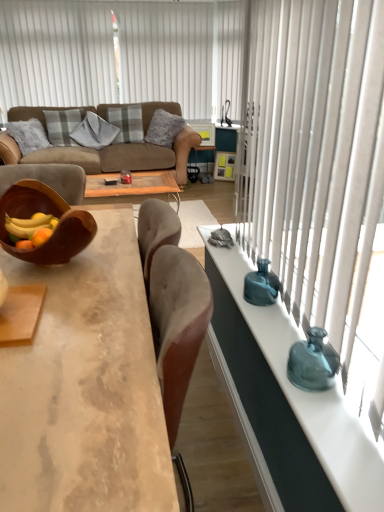
Find the location of a particular element. The width and height of the screenshot is (384, 512). free location in front of teal glass vase at right, marked as the 2th vase in a back-to-front arrangement is located at coordinates (336, 420).